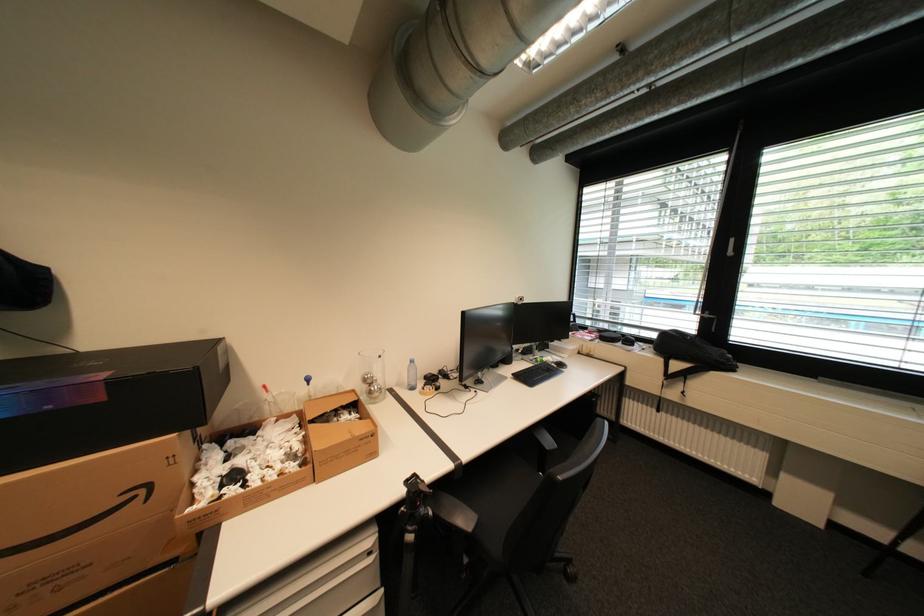
Describe the element at coordinates (748, 257) in the screenshot. I see `the white window handle` at that location.